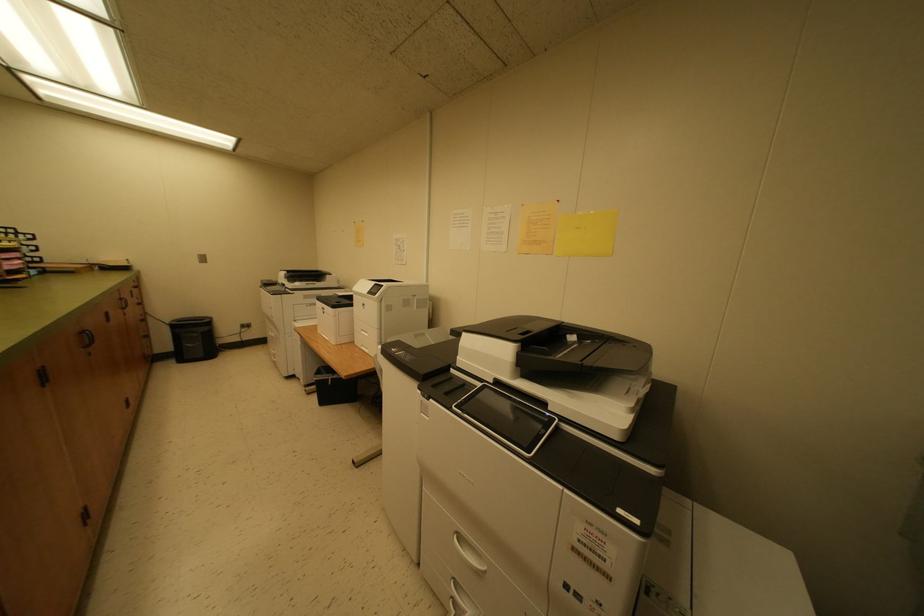
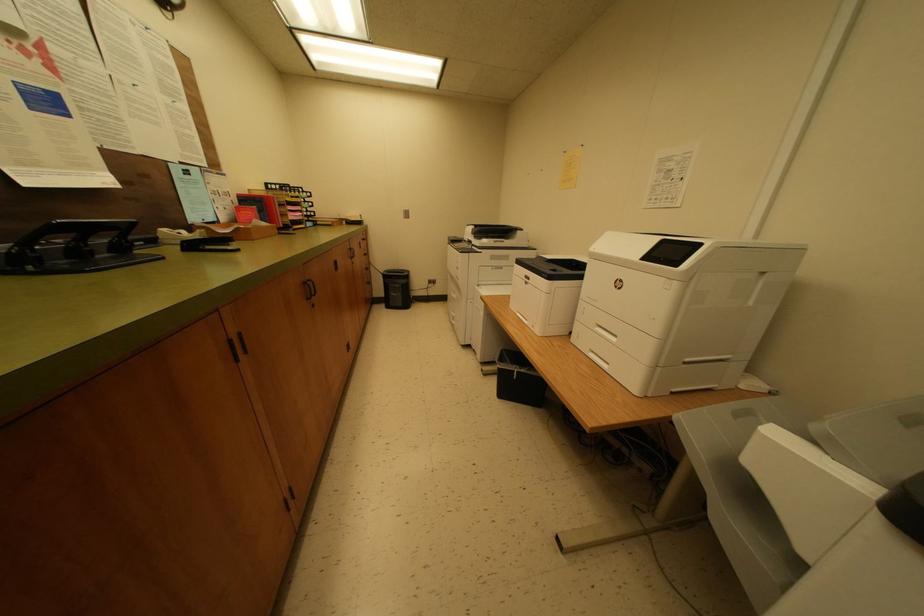
Question: The images are taken continuously from a first-person perspective. In which direction is your viewpoint rotating?

Choices:
 (A) Left
 (B) Right
 (C) Up
 (D) Down

Answer: (A)